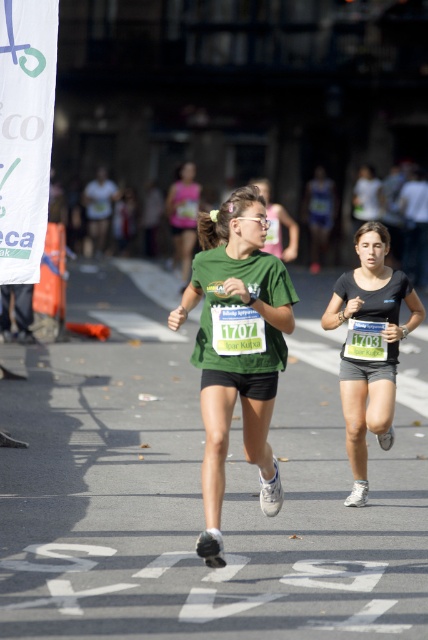
You are a photographer positioned at the center of the image. You want to capture a photo of the black matte shorts at center. Where should you aim your camera?

The black matte shorts at center are located at the 2D coordinates point (369, 346), so you should aim your camera at that point to capture them.